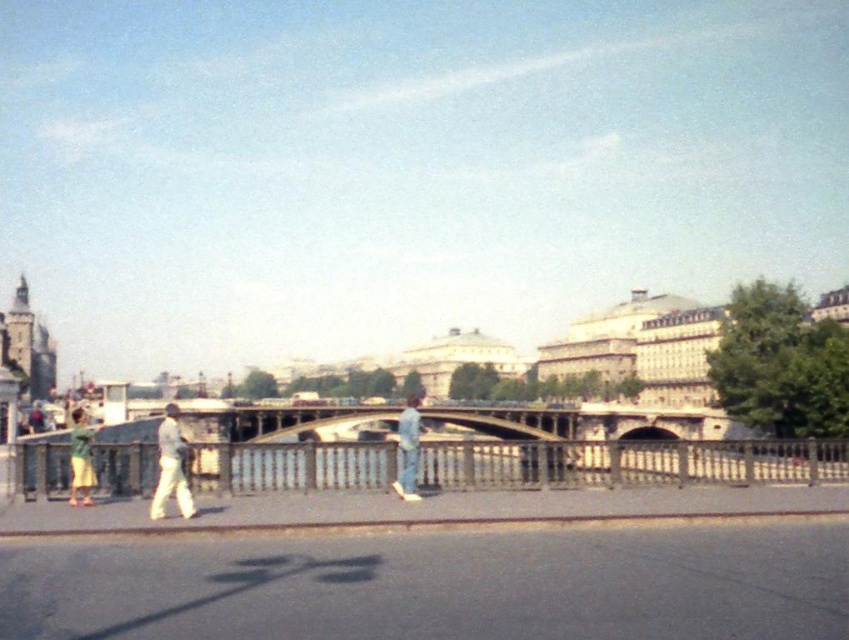
Is point (181, 435) positioned before point (79, 448)?

No.

Does white matte pants at center have a greater width compared to green fabric shorts at left?

No, white matte pants at center is not wider than green fabric shorts at left.

Which is in front, point (167, 420) or point (77, 477)?

Point (77, 477) is in front.

This screenshot has height=640, width=849. Identify the location of white matte pants at center. (171, 467).

Does point (401, 452) lie behind point (76, 412)?

No, it is not.

Based on the photo, which of these two, blue jeans at center or green fabric shorts at left, stands shorter?

green fabric shorts at left is shorter.

Locate an element on the screen. This screenshot has height=640, width=849. blue jeans at center is located at coordinates (408, 449).

Consider the image. Can you confirm if white matte pants at center is thinner than blue jeans at center?

Incorrect, white matte pants at center's width is not less than blue jeans at center's.

Is white matte pants at center to the left of blue jeans at center from the viewer's perspective?

Yes, white matte pants at center is to the left of blue jeans at center.

Between point (161, 516) and point (417, 406), which one is positioned behind?

Point (417, 406)

This screenshot has width=849, height=640. Identify the location of white matte pants at center. (171, 467).